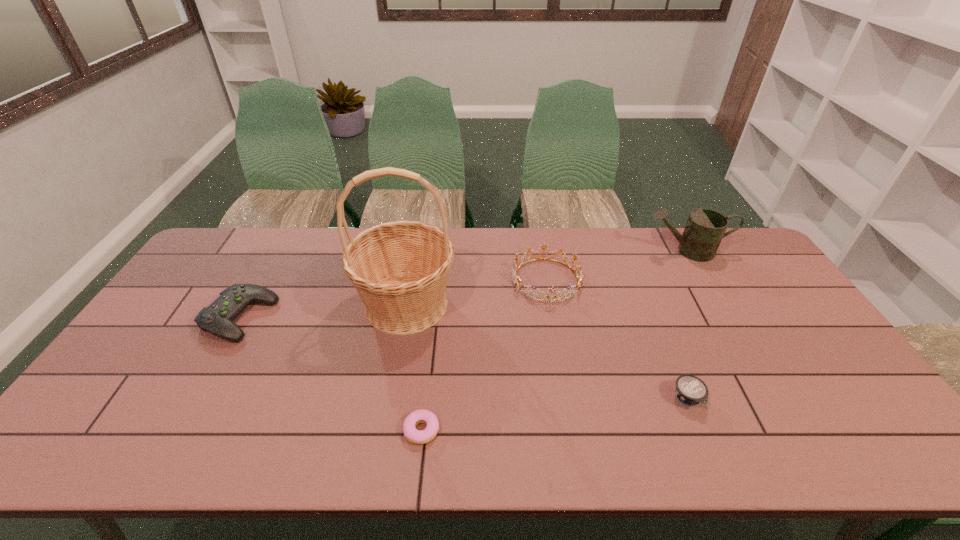
The width and height of the screenshot is (960, 540). I want to click on vacant area between the leftmost object and the fifth tallest object, so click(464, 358).

Find the location of `unoccupied position between the tallest object and the shortest object`. unoccupied position between the tallest object and the shortest object is located at coordinates (414, 367).

At what (x,y) coordinates should I click in order to perform the action: click on free area in between the watering can and the control. Please return your answer as a coordinate pair (x, y). Looking at the image, I should click on (464, 284).

At what (x,y) coordinates should I click in order to perform the action: click on vacant space that is in between the shortest object and the fifth shortest object. Please return your answer as a coordinate pair (x, y). This screenshot has width=960, height=540. Looking at the image, I should click on (554, 341).

The height and width of the screenshot is (540, 960). Identify the location of vacant region between the control and the second shortest object. (464, 358).

The width and height of the screenshot is (960, 540). What are the coordinates of `unoccupied position between the tallest object and the fifth shortest object` in the screenshot? It's located at (546, 278).

Locate an element on the screen. free spot between the control and the second shortest object is located at coordinates (464, 358).

Locate an element on the screen. Image resolution: width=960 pixels, height=540 pixels. free point between the second object from right to left and the shortest object is located at coordinates (555, 415).

Locate an element on the screen. free area in between the watering can and the doughnut is located at coordinates (554, 341).

You are a GUI agent. You are given a task and a screenshot of the screen. Output one action in this format:
    pyautogui.click(x=<x>, y=<y>)
    Task: Click on the object that is the closest to the doughnut
    
    Given the screenshot: What is the action you would take?
    pyautogui.click(x=400, y=269)